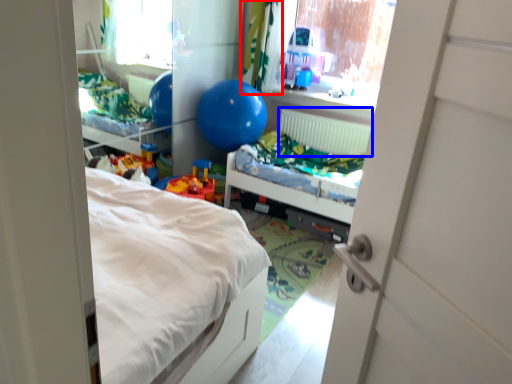
Question: Among these objects, which one is nearest to the camera, curtain (highlighted by a red box) or radiator (highlighted by a blue box)?

Choices:
 (A) curtain
 (B) radiator

Answer: (A)